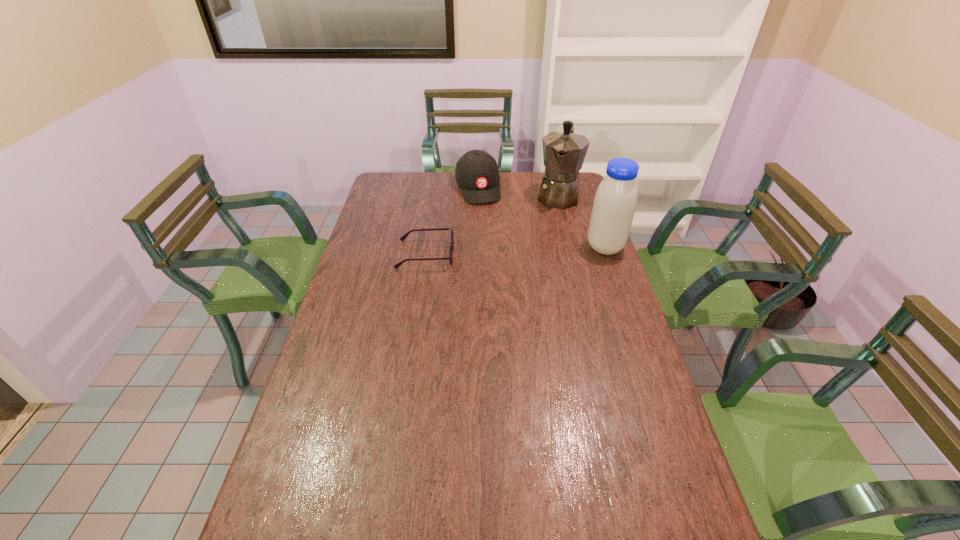
Locate an element on the screen. free area in between the second shortest object and the coffeepot is located at coordinates (517, 192).

Locate an element on the screen. vacant space that's between the second shortest object and the coffeepot is located at coordinates (517, 192).

Find the location of a particular element. vacant space in between the soya milk and the baseball cap is located at coordinates (541, 218).

At what (x,y) coordinates should I click in order to perform the action: click on object that is the closest to the coffeepot. Please return your answer as a coordinate pair (x, y). Looking at the image, I should click on (615, 201).

Select which object is the second closest to the spectacles. Please provide its 2D coordinates. Your answer should be formatted as a tuple, i.e. [(x, y)], where the tuple contains the x and y coordinates of a point satisfying the conditions above.

[(564, 152)]

You are a GUI agent. You are given a task and a screenshot of the screen. Output one action in this format:
    pyautogui.click(x=<x>, y=<y>)
    Task: Click on the free space that satisfies the following two spatial constraints: 1. on the front side of the coffeepot; 2. on the right side of the third tallest object
    The width and height of the screenshot is (960, 540).
    Given the screenshot: What is the action you would take?
    pyautogui.click(x=477, y=195)

Where is `vacant region that satisfies the following two spatial constraints: 1. on the front side of the second shortest object; 2. on the left side of the soya milk`? The width and height of the screenshot is (960, 540). vacant region that satisfies the following two spatial constraints: 1. on the front side of the second shortest object; 2. on the left side of the soya milk is located at coordinates [477, 247].